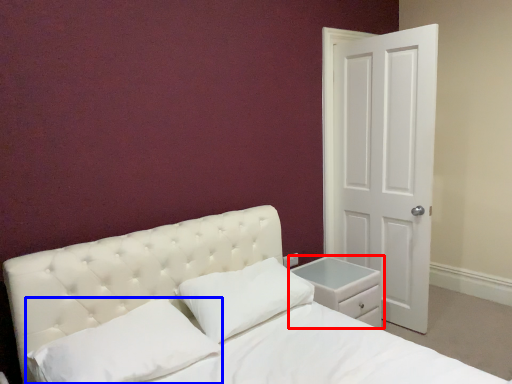
Question: Which of the following is the closest to the observer, nightstand (highlighted by a red box) or pillow (highlighted by a blue box)?

Choices:
 (A) nightstand
 (B) pillow

Answer: (B)